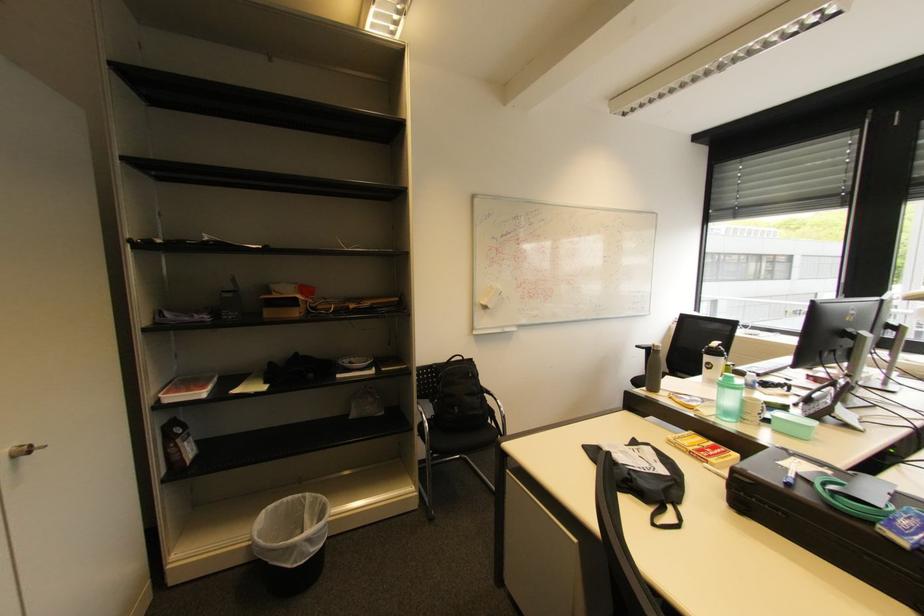
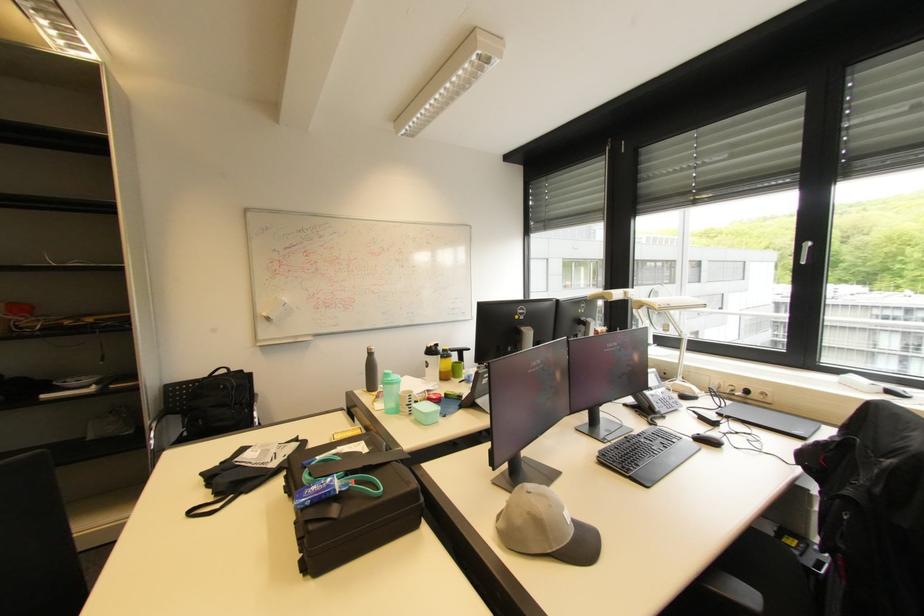
Find the pixel in the second image that matches (738,383) in the first image.

(394, 379)